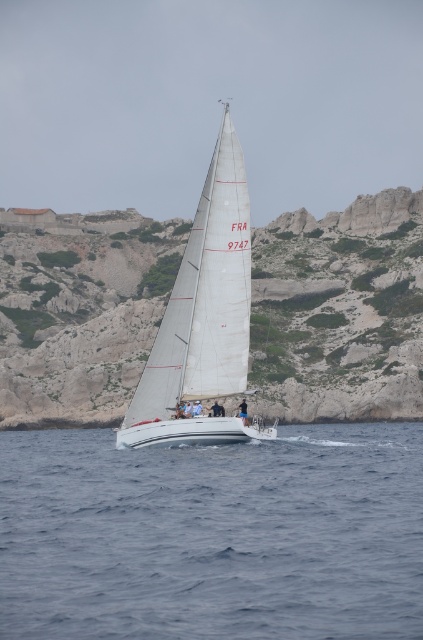
Question: Is blue water at center closer to camera compared to white sail at center?

Choices:
 (A) no
 (B) yes

Answer: (B)

Question: Estimate the real-world distances between objects in this image. Which object is closer to the white sail at center?

Choices:
 (A) rocky cliff at center
 (B) blue water at center

Answer: (B)

Question: Can you confirm if blue water at center is positioned below white sail at center?

Choices:
 (A) no
 (B) yes

Answer: (B)

Question: Is rocky cliff at center closer to the viewer compared to white sail at center?

Choices:
 (A) yes
 (B) no

Answer: (B)

Question: Which point is farther to the camera?

Choices:
 (A) blue water at center
 (B) white sail at center

Answer: (B)

Question: Which object is farther from the camera taking this photo?

Choices:
 (A) blue water at center
 (B) rocky cliff at center

Answer: (B)